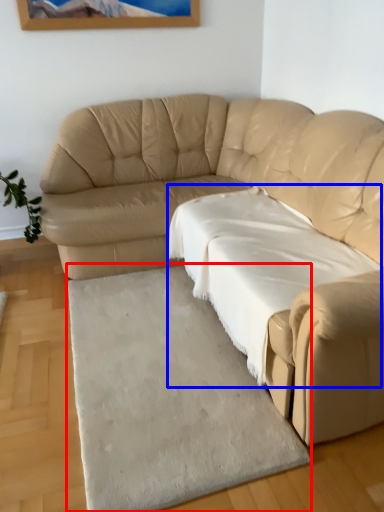
Question: Which object is further to the camera taking this photo, mat (highlighted by a red box) or sheet (highlighted by a blue box)?

Choices:
 (A) mat
 (B) sheet

Answer: (B)